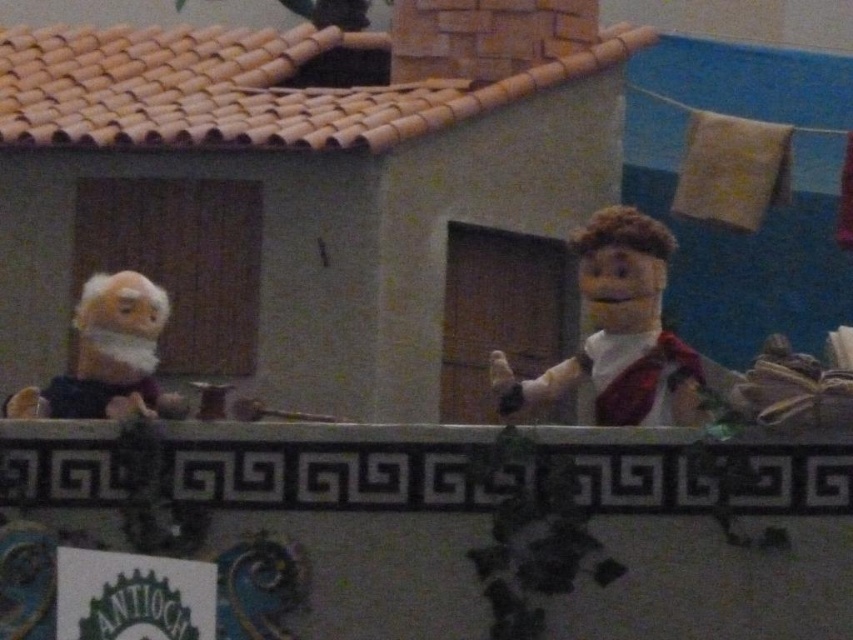
Question: Among these points, which one is farthest from the camera?

Choices:
 (A) (160, 408)
 (B) (639, 376)

Answer: (B)

Question: Is white fabric puppet at center to the left of white plush monkey at left from the viewer's perspective?

Choices:
 (A) no
 (B) yes

Answer: (A)

Question: Which of the following is the farthest from the observer?

Choices:
 (A) white fabric puppet at center
 (B) white plush monkey at left

Answer: (A)

Question: Does white fabric puppet at center have a greater width compared to white plush monkey at left?

Choices:
 (A) no
 (B) yes

Answer: (A)

Question: Which of the following is the farthest from the observer?

Choices:
 (A) white plush monkey at left
 (B) white fabric puppet at center

Answer: (B)

Question: Is white fabric puppet at center above white plush monkey at left?

Choices:
 (A) yes
 (B) no

Answer: (A)